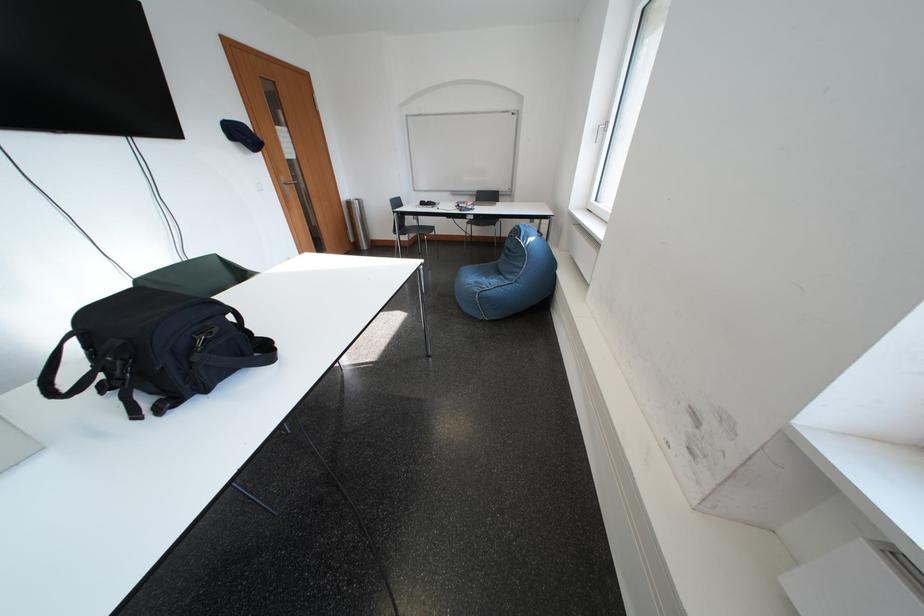
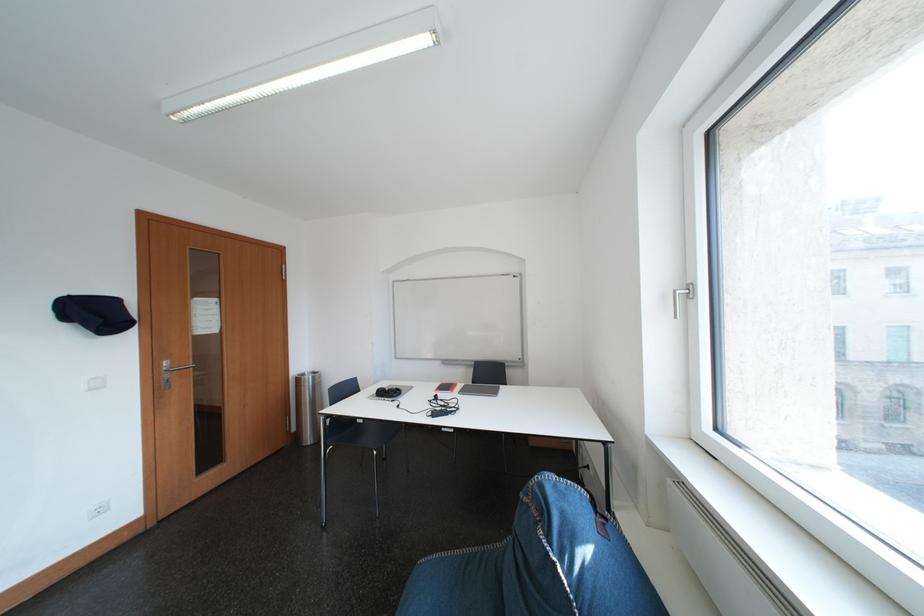
In the second image, find the point that corresponds to point (434, 207) in the first image.

(393, 395)